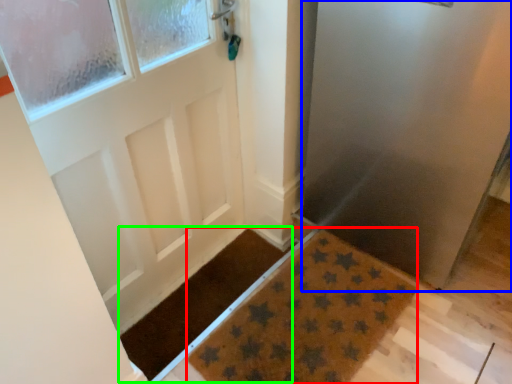
Question: Which object is the closest to the doormat (highlighted by a red box)? Choose among these: screen door (highlighted by a blue box) or doormat (highlighted by a green box).

Choices:
 (A) screen door
 (B) doormat

Answer: (B)